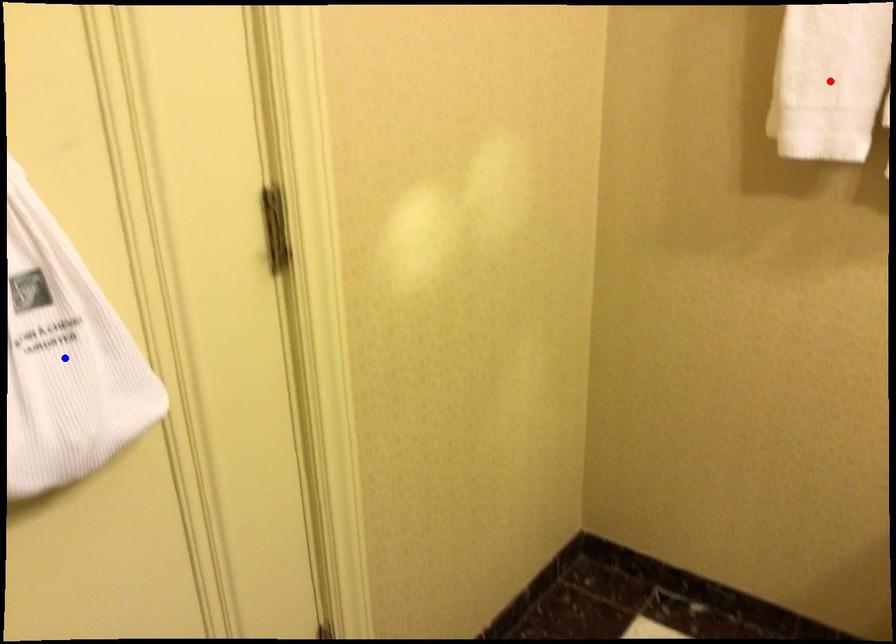
Question: Which of the two points in the image is closer to the camera?

Choices:
 (A) Blue point is closer.
 (B) Red point is closer.

Answer: (A)